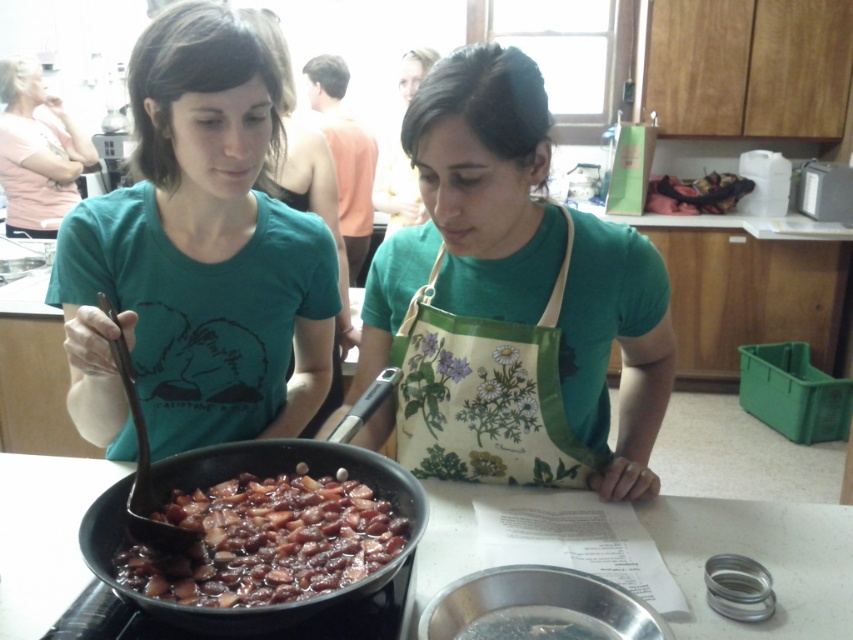
You are standing in the kitchen and want to place a small bowl between the two points, point (282, 552) and point (16, 144). Which point should the bowl be closer to if you want it to be closer to the person on the left?

The bowl should be closer to point (16, 144) because point (282, 552) is in front of point (16, 144), meaning it is further away from you. To place the bowl closer to the person on the left, it should be nearer to point (16, 144).

In the scene shown: You are a chef in a kitchen and see the shiny brown beans at center and the pink cotton shirt at upper left. Which object is positioned more to the right?

The shiny brown beans at center is positioned more to the right than the pink cotton shirt at upper left.